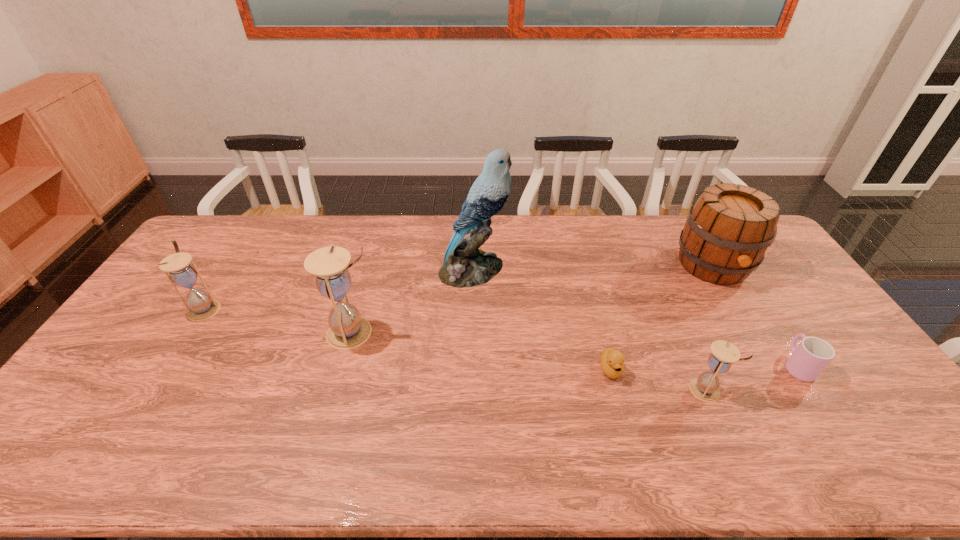
You are a GUI agent. You are given a task and a screenshot of the screen. Output one action in this format:
    pyautogui.click(x=<x>, y=<y>)
    Task: Click on the vacant position at the left edge of the desktop
    
    Given the screenshot: What is the action you would take?
    pyautogui.click(x=163, y=335)

Image resolution: width=960 pixels, height=540 pixels. In order to click on free spot at the right edge of the desktop in this screenshot , I will do `click(799, 325)`.

Identify the location of vacant space at the near left corner. This screenshot has width=960, height=540. (123, 400).

You are a GUI agent. You are given a task and a screenshot of the screen. Output one action in this format:
    pyautogui.click(x=<x>, y=<y>)
    Task: Click on the blank region between the cup and the fifth object from left to right
    The height and width of the screenshot is (540, 960).
    Given the screenshot: What is the action you would take?
    pyautogui.click(x=752, y=377)

Find the location of a particular element. The image size is (960, 540). blank region between the cider and the fourth object from right to left is located at coordinates (662, 318).

The height and width of the screenshot is (540, 960). In order to click on free space between the fourth object from left to right and the cider in this screenshot , I will do `click(662, 318)`.

Image resolution: width=960 pixels, height=540 pixels. Find the location of `free space between the cup and the fifth tallest object`. free space between the cup and the fifth tallest object is located at coordinates (752, 377).

Find the location of a particular element. This screenshot has height=540, width=960. vacant point located between the fourth object from left to right and the leftmost hourglass is located at coordinates (408, 339).

Locate an element on the screen. This screenshot has height=540, width=960. empty space between the shortest hourglass and the cup is located at coordinates (752, 377).

This screenshot has height=540, width=960. What are the coordinates of `vacant space in between the cider and the shortest object` in the screenshot? It's located at (662, 318).